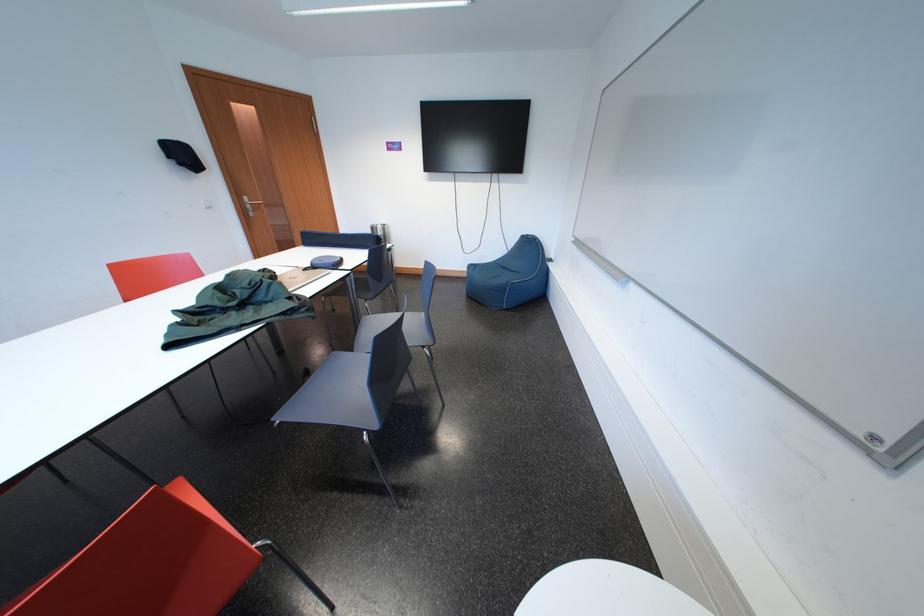
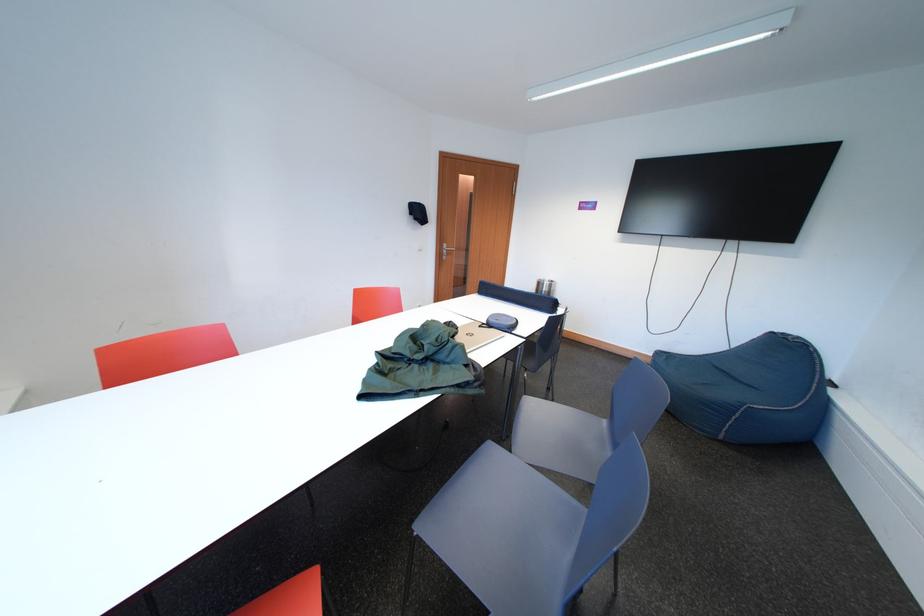
In the second image, find the point that corresponds to [383,233] in the first image.

(549, 288)